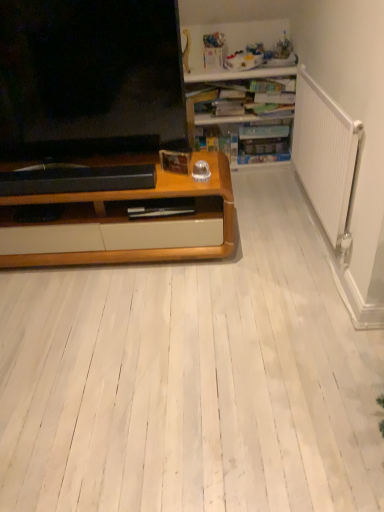
Question: Considering the positions of wooden desk at upper right and matte black television at left in the image, is wooden desk at upper right taller or shorter than matte black television at left?

Choices:
 (A) short
 (B) tall

Answer: (A)

Question: Considering the relative positions of wooden desk at upper right and matte black television at left in the image provided, is wooden desk at upper right to the left or to the right of matte black television at left?

Choices:
 (A) left
 (B) right

Answer: (B)

Question: In terms of size, does wooden desk at upper right appear bigger or smaller than matte black television at left?

Choices:
 (A) small
 (B) big

Answer: (B)

Question: From the image's perspective, is matte black television at left located above or below wooden desk at upper right?

Choices:
 (A) below
 (B) above

Answer: (A)

Question: Considering the positions of point (115, 19) and point (258, 74), is point (115, 19) closer or farther from the camera than point (258, 74)?

Choices:
 (A) farther
 (B) closer

Answer: (B)

Question: Would you say matte black television at left is to the left or to the right of wooden desk at upper right in the picture?

Choices:
 (A) left
 (B) right

Answer: (A)

Question: From a real-world perspective, is matte black television at left above or below wooden desk at upper right?

Choices:
 (A) below
 (B) above

Answer: (B)